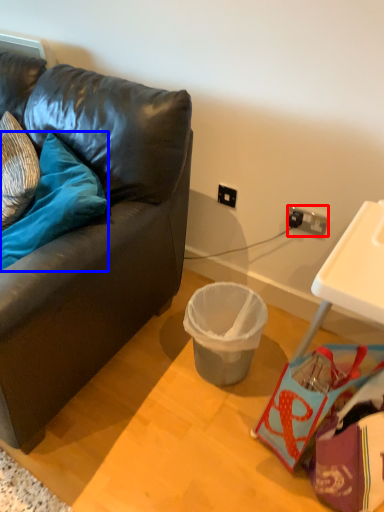
Question: Among these objects, which one is farthest to the camera, power outlet (highlighted by a red box) or pillow (highlighted by a blue box)?

Choices:
 (A) power outlet
 (B) pillow

Answer: (A)